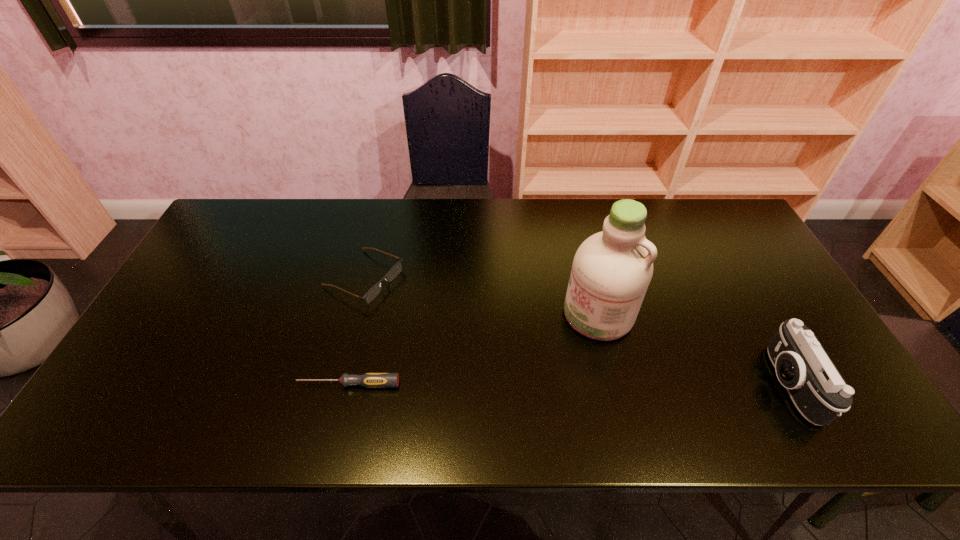
Locate an element on the screen. The height and width of the screenshot is (540, 960). empty space that is in between the tallest object and the second shortest object is located at coordinates (481, 295).

This screenshot has width=960, height=540. Find the location of `vacant area that lies between the shortest object and the spectacles`. vacant area that lies between the shortest object and the spectacles is located at coordinates (356, 330).

At what (x,y) coordinates should I click in order to perform the action: click on vacant area between the third tallest object and the tallest object. Please return your answer as a coordinate pair (x, y). Looking at the image, I should click on (481, 295).

This screenshot has width=960, height=540. Identify the location of vacant space in between the spectacles and the screwdriver. (356, 330).

Where is `free space between the shortest object and the rightmost object`? Image resolution: width=960 pixels, height=540 pixels. free space between the shortest object and the rightmost object is located at coordinates (568, 384).

Select which object is the closest to the spectacles. Please provide its 2D coordinates. Your answer should be formatted as a tuple, i.e. [(x, y)], where the tuple contains the x and y coordinates of a point satisfying the conditions above.

[(370, 380)]

This screenshot has height=540, width=960. In order to click on the closest object to the second shortest object in this screenshot , I will do `click(370, 380)`.

The height and width of the screenshot is (540, 960). I want to click on vacant space that satisfies the following two spatial constraints: 1. on the front side of the second shortest object; 2. insert the shortest object into a screw head, so click(x=337, y=384).

Identify the location of vacant area in the image that satisfies the following two spatial constraints: 1. on the front side of the rightmost object; 2. on the front lens of the second shortest object. The height and width of the screenshot is (540, 960). [337, 384].